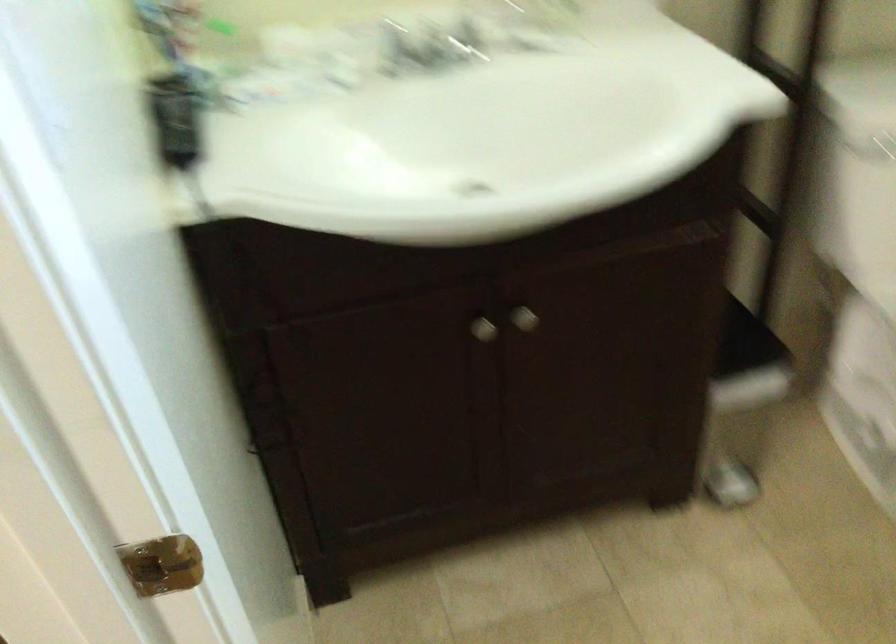
Based on the photo, the first image is from the beginning of the video and the second image is from the end. How did the camera likely rotate when shooting the video?

The rotation direction of the camera is left-down.